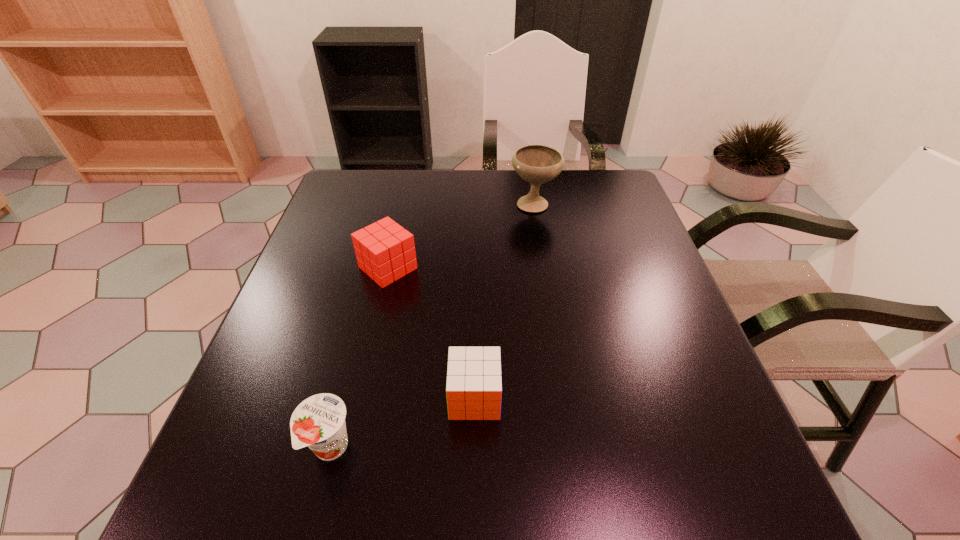
Find the location of a particular element. This screenshot has height=540, width=960. the rightmost object is located at coordinates (537, 164).

Identify the location of chalice. (537, 164).

Where is `the farther cube`? the farther cube is located at coordinates (385, 251).

You are a GUI agent. You are given a task and a screenshot of the screen. Output one action in this format:
    pyautogui.click(x=<x>, y=<y>)
    Task: Click on the third nearest object
    The height and width of the screenshot is (540, 960).
    Given the screenshot: What is the action you would take?
    pyautogui.click(x=385, y=251)

Where is `the right cube`? This screenshot has height=540, width=960. the right cube is located at coordinates (474, 383).

Find the location of a particular element. the second nearest object is located at coordinates (474, 383).

You are a GUI agent. You are given a task and a screenshot of the screen. Output one action in this format:
    pyautogui.click(x=<x>, y=<y>)
    Task: Click on the yogurt
    
    Given the screenshot: What is the action you would take?
    pyautogui.click(x=318, y=422)

Locate an element on the screen. vacant space located 0.140m on the left of the chalice is located at coordinates (462, 203).

Locate an element on the screen. The image size is (960, 540). free location located on the right of the third nearest object is located at coordinates (569, 268).

You are a GUI agent. You are given a task and a screenshot of the screen. Output one action in this format:
    pyautogui.click(x=<x>, y=<y>)
    Task: Click on the free location located 0.280m on the right of the second object from right to left
    This screenshot has width=960, height=540.
    Given the screenshot: What is the action you would take?
    pyautogui.click(x=652, y=397)